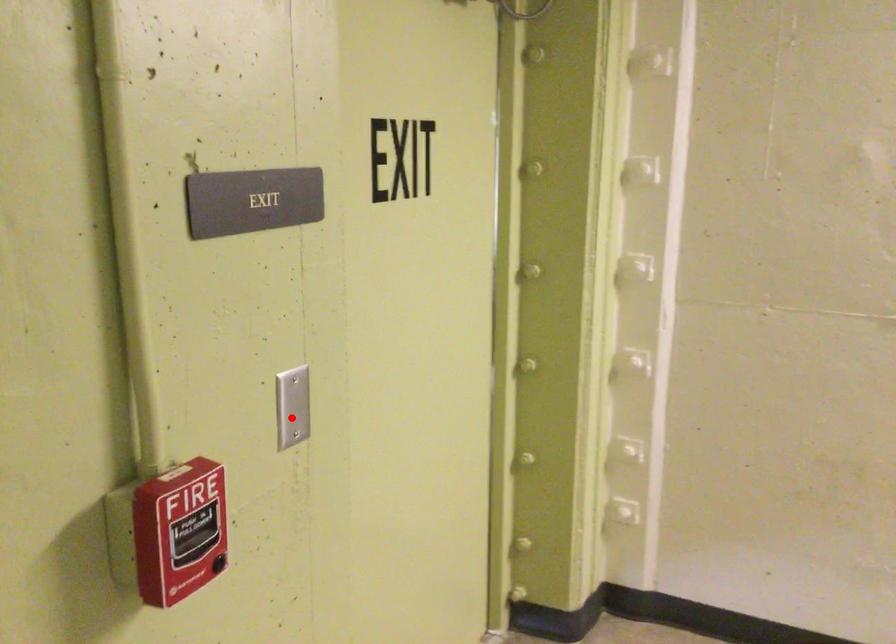
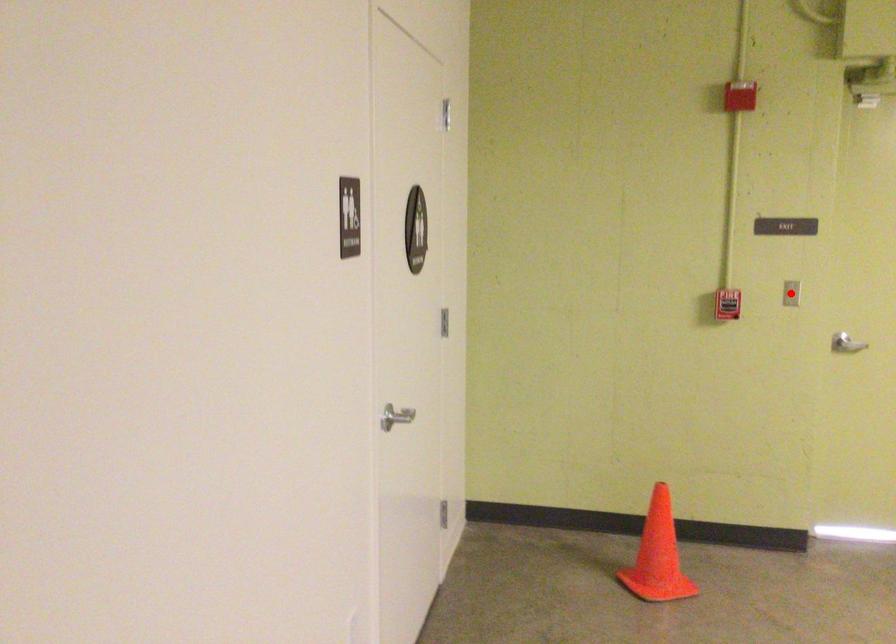
I am providing you with two images of the same scene from different viewpoints. A red point is marked on the first image and another point is marked on the second image. Is the red point in image1 aligned with the point shown in image2?

Yes